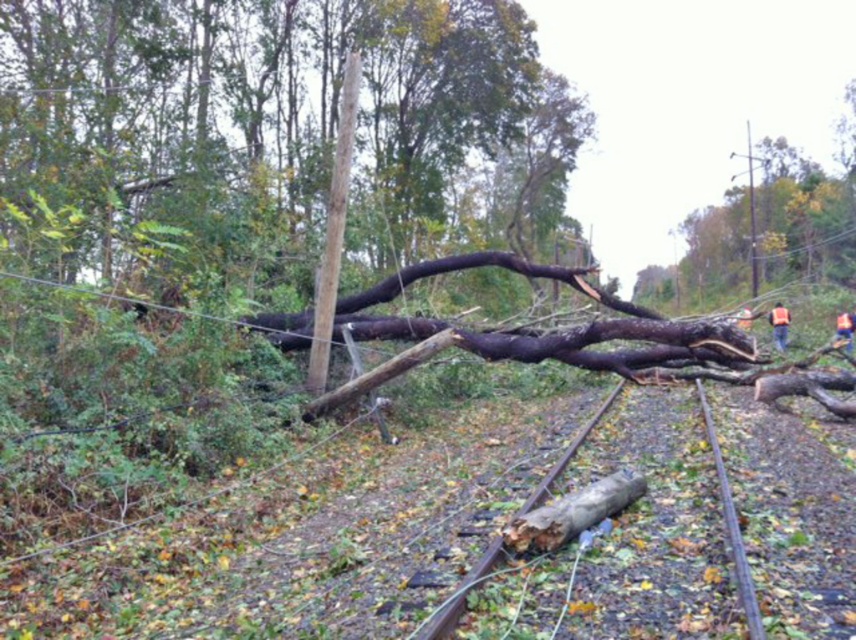
Is brown wood log at center wider than orange reflective vest at right?

Correct, the width of brown wood log at center exceeds that of orange reflective vest at right.

Between brown wood log at center and orange reflective vest at right, which one is positioned lower?

brown wood log at center is below.

Image resolution: width=856 pixels, height=640 pixels. Describe the element at coordinates (730, 524) in the screenshot. I see `brown wood log at center` at that location.

This screenshot has width=856, height=640. What are the coordinates of `brown wood log at center` in the screenshot? It's located at (730, 524).

Who is more forward, (615, 500) or (782, 314)?

Point (615, 500) is in front.

Who is more distant from viewer, (x=572, y=497) or (x=780, y=332)?

The point (x=780, y=332) is behind.

Between point (524, 529) and point (780, 332), which one is positioned in front?

Point (524, 529)

The width and height of the screenshot is (856, 640). I want to click on brown rough log at lower center, so click(x=574, y=513).

Where is `brown wood log at center`? brown wood log at center is located at coordinates (730, 524).

Can you confirm if brown wood log at center is wider than brown rough log at lower center?

Indeed, brown wood log at center has a greater width compared to brown rough log at lower center.

At what (x,y) coordinates should I click in order to perform the action: click on brown wood log at center. Please return your answer as a coordinate pair (x, y). Looking at the image, I should click on (730, 524).